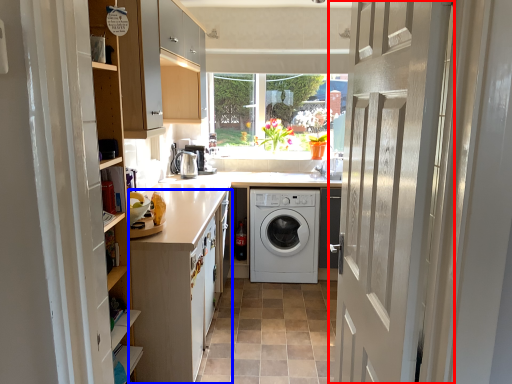
Question: Among these objects, which one is nearest to the camera, door (highlighted by a red box) or cabinetry (highlighted by a blue box)?

Choices:
 (A) door
 (B) cabinetry

Answer: (A)